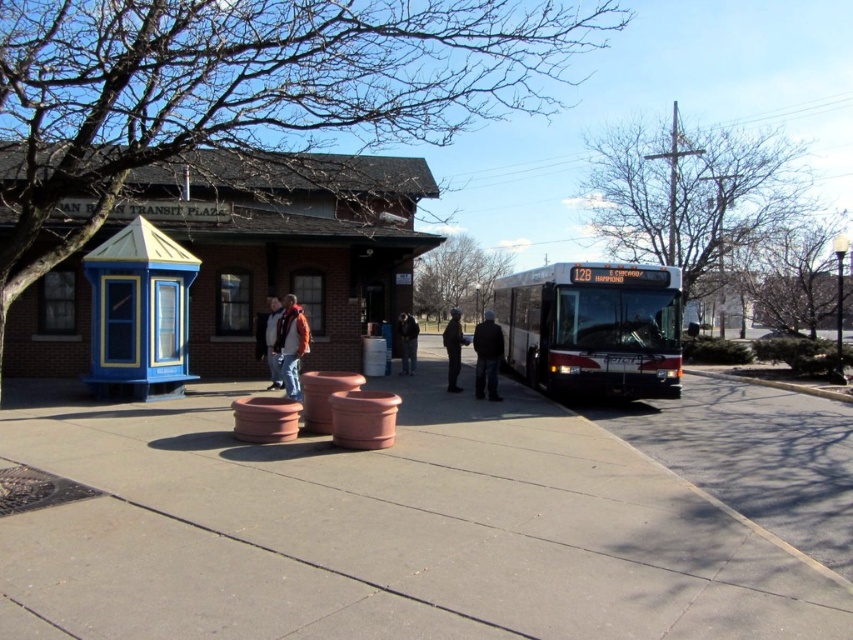
You are standing at the transit plaza and want to determine the relative positions of two points marked on the ground. Which point, point 1 at coordinates (149,349) or point 2 at coordinates (277,376), is closer to you?

Point 1 at coordinates (149,349) is closer to the viewer than point 2 at coordinates (277,376).

What are the coordinates of the concrete at center in the image?

The coordinates of the concrete at center are at point (434, 518).

You are standing at point (x=434, y=518) in the transit plaza. What material are you standing on?

You are standing on concrete at center.